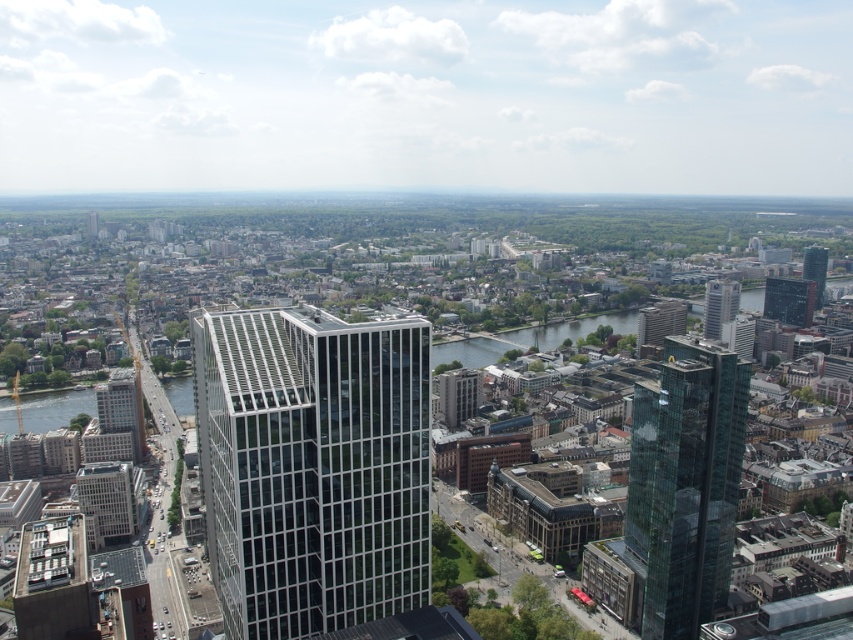
You are an urban planner reviewing this city layout. You need to determine which of the two points, point (379, 339) or point (699, 480), is situated closer to the foreground buildings. Based on the aerial view, which point is nearer to the foreground buildings?

Point (379, 339) is closer to the viewer than point (699, 480), so it is situated closer to the foreground buildings.